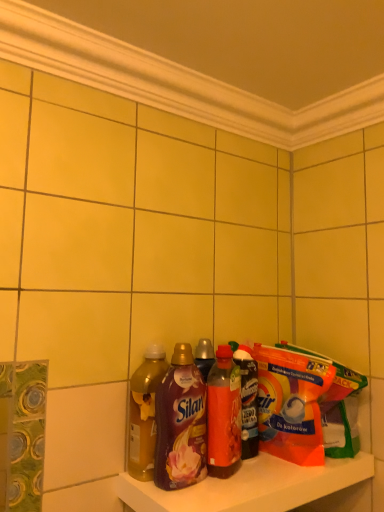
Identify the location of vacant space to the right of translucent plastic bottle at center, placed as the 4th bottle when sorted from left to right. The height and width of the screenshot is (512, 384). (307, 463).